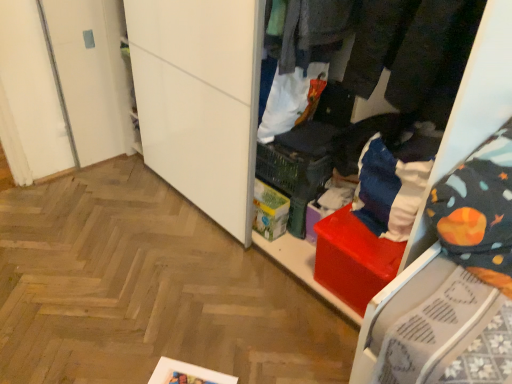
Question: Is dark gray fabric pants at center, acting as the second clothing starting from the front, aimed at white fabric bag at center, the 4th clothing positioned from the front?

Choices:
 (A) no
 (B) yes

Answer: (A)

Question: Is dark gray fabric pants at center, arranged as the third clothing when viewed from the back, turned away from white fabric bag at center, positioned as the first clothing in back-to-front order?

Choices:
 (A) yes
 (B) no

Answer: (B)

Question: Is dark gray fabric pants at center, arranged as the third clothing when viewed from the back, wider than white fabric bag at center, positioned as the first clothing in back-to-front order?

Choices:
 (A) yes
 (B) no

Answer: (A)

Question: Is dark gray fabric pants at center, arranged as the third clothing when viewed from the back, in front of white fabric bag at center, the 4th clothing positioned from the front?

Choices:
 (A) no
 (B) yes

Answer: (B)

Question: From a real-world perspective, does dark gray fabric pants at center, acting as the second clothing starting from the front, stand above white fabric bag at center, the 4th clothing positioned from the front?

Choices:
 (A) no
 (B) yes

Answer: (B)

Question: Considering the relative sizes of dark gray fabric pants at center, acting as the second clothing starting from the front, and white fabric bag at center, positioned as the first clothing in back-to-front order, in the image provided, is dark gray fabric pants at center, acting as the second clothing starting from the front, thinner than white fabric bag at center, positioned as the first clothing in back-to-front order,?

Choices:
 (A) no
 (B) yes

Answer: (A)

Question: From a real-world perspective, is dark gray fabric pants at center, arranged as the third clothing when viewed from the back, over dark gray fabric pants at upper center, which appears as the 3th clothing when viewed from the front?

Choices:
 (A) no
 (B) yes

Answer: (B)

Question: Is dark gray fabric pants at center, acting as the second clothing starting from the front, positioned before dark gray fabric pants at upper center, marked as the 2th clothing in a back-to-front arrangement?

Choices:
 (A) yes
 (B) no

Answer: (A)

Question: From the image's perspective, is dark gray fabric pants at center, arranged as the third clothing when viewed from the back, located beneath dark gray fabric pants at upper center, marked as the 2th clothing in a back-to-front arrangement?

Choices:
 (A) yes
 (B) no

Answer: (A)

Question: From the image's perspective, is dark gray fabric pants at center, acting as the second clothing starting from the front, on top of dark gray fabric pants at upper center, which appears as the 3th clothing when viewed from the front?

Choices:
 (A) no
 (B) yes

Answer: (A)

Question: Considering the relative sizes of dark gray fabric pants at center, acting as the second clothing starting from the front, and dark gray fabric pants at upper center, which appears as the 3th clothing when viewed from the front, in the image provided, is dark gray fabric pants at center, acting as the second clothing starting from the front, thinner than dark gray fabric pants at upper center, which appears as the 3th clothing when viewed from the front,?

Choices:
 (A) no
 (B) yes

Answer: (A)

Question: Is dark gray fabric pants at center, acting as the second clothing starting from the front, bigger than dark gray fabric pants at upper center, which appears as the 3th clothing when viewed from the front?

Choices:
 (A) no
 (B) yes

Answer: (B)

Question: Is black fabric pants at upper right, acting as the 4th clothing starting from the back, to the left of dark gray fabric pants at center, acting as the second clothing starting from the front, from the viewer's perspective?

Choices:
 (A) yes
 (B) no

Answer: (B)